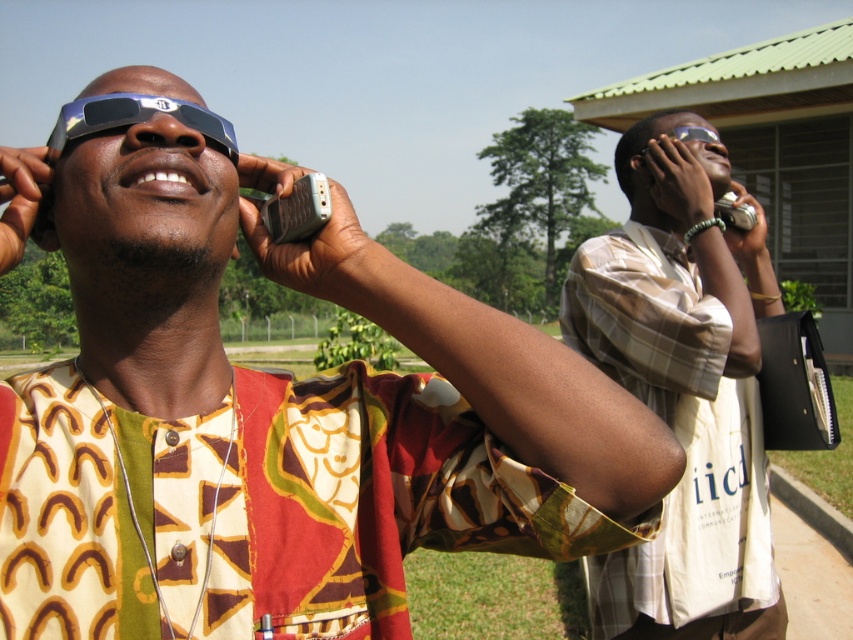
Between blue reflective glasses at upper center and transparent plastic goggles at upper center, which one appears on the left side from the viewer's perspective?

Positioned to the left is blue reflective glasses at upper center.

Between point (230, 134) and point (711, 132), which one is positioned behind?

Point (711, 132)

Is point (109, 120) closer to viewer compared to point (703, 140)?

Yes, it is.

Locate an element on the screen. This screenshot has width=853, height=640. blue reflective glasses at upper center is located at coordinates (136, 120).

Describe the element at coordinates (683, 388) in the screenshot. I see `plaid shirt at center` at that location.

Does point (721, 456) come behind point (62, 120)?

Yes, point (721, 456) is farther from viewer.

I want to click on plaid shirt at center, so click(683, 388).

Where is `matte plastic sunglasses at upper left`? matte plastic sunglasses at upper left is located at coordinates (276, 419).

Identify the location of matte plastic sunglasses at upper left. (276, 419).